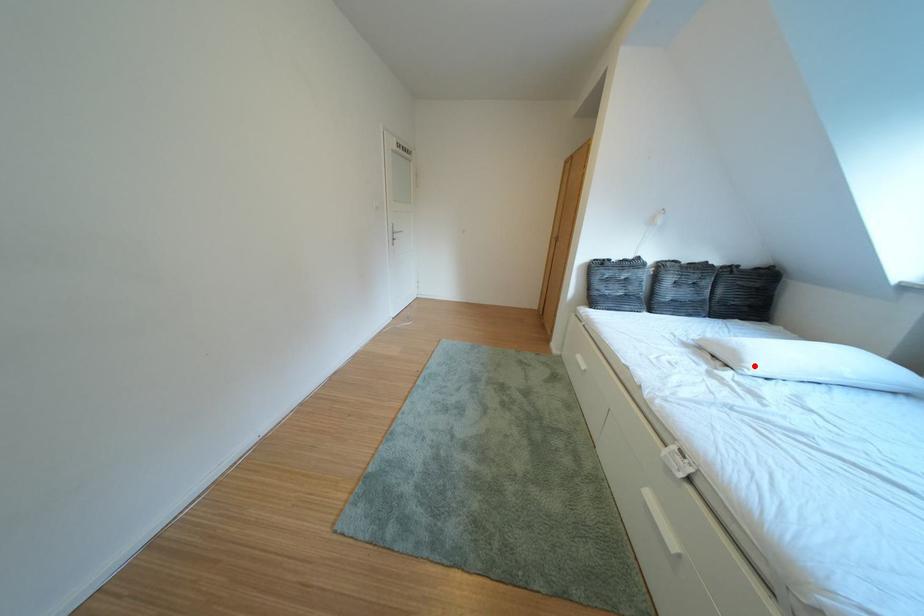
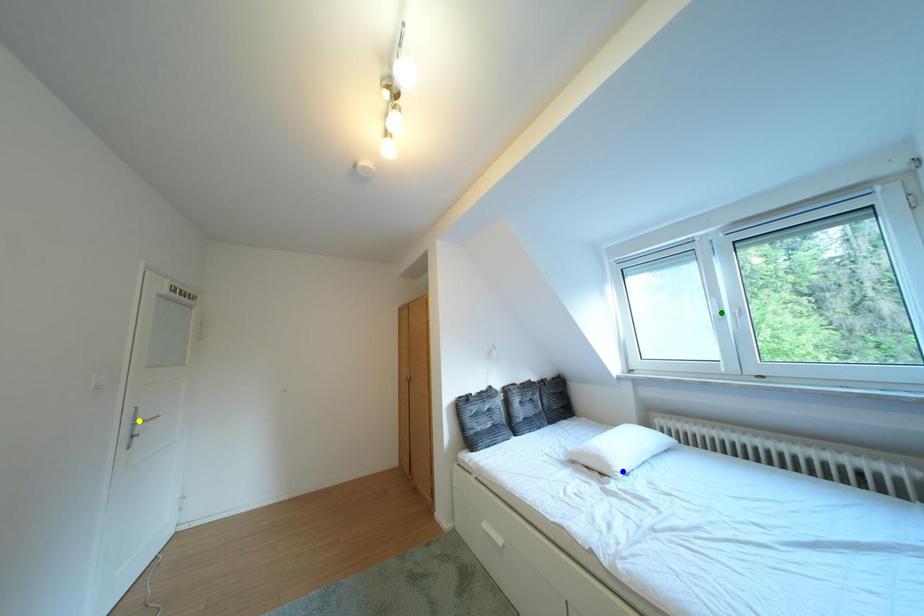
Question: I am providing you with two images of the same scene from different viewpoints. A red point is marked on the first image. You are given multiple points on the second image. Which mark in image 2 goes with the point in image 1?

Choices:
 (A) blue point
 (B) yellow point
 (C) green point

Answer: (A)